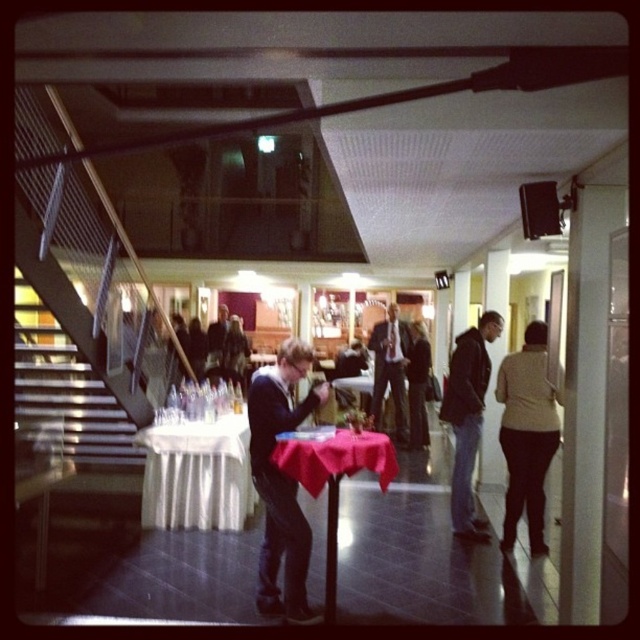
You are standing in the room and want to place a small book on the smooth red tablecloth at center. Considering the height of the dark blue jeans at center, will the book be visible to someone looking from the doorway?

The smooth red tablecloth at center has a lesser height compared to dark blue jeans at center. Since the tablecloth is lower, the book placed on it may be partially or fully obscured by the jeans if they are positioned between the tablecloth and the doorway. However, visibility also depends on the exact positioning of the jeans relative to the line of sight from the doorway.